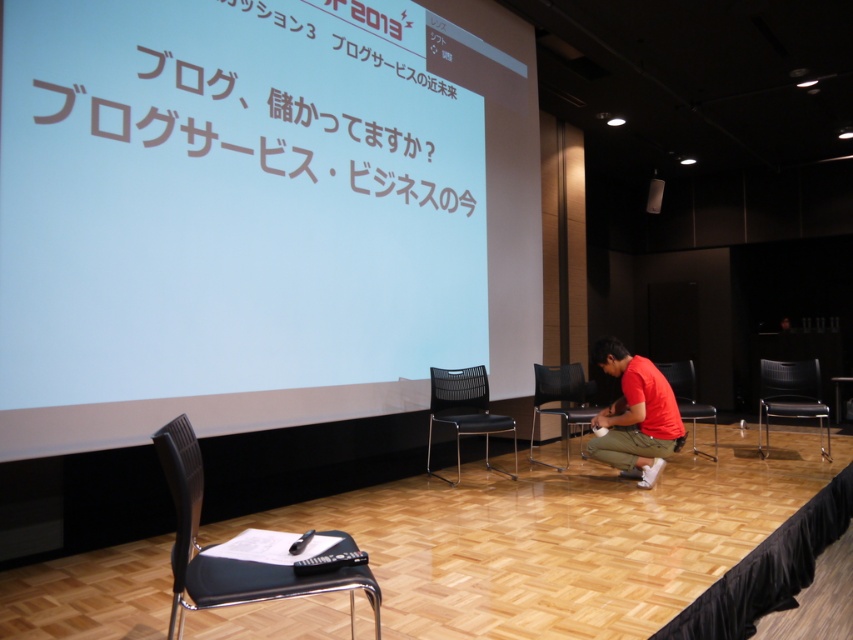
Can you confirm if black plastic chair at lower left is positioned below matte red shirt at lower right?

Yes, black plastic chair at lower left is below matte red shirt at lower right.

Is black plastic chair at lower left above matte red shirt at lower right?

No, black plastic chair at lower left is not above matte red shirt at lower right.

Does point (177, 579) lie in front of point (624, 378)?

Yes, point (177, 579) is closer to viewer.

Locate an element on the screen. black plastic chair at lower left is located at coordinates (231, 557).

Is matte red shirt at lower right smaller than black mesh chair at right?

Incorrect, matte red shirt at lower right is not smaller in size than black mesh chair at right.

Who is more forward, (x=613, y=349) or (x=775, y=380)?

Point (x=613, y=349) is in front.

This screenshot has width=853, height=640. Find the location of `matte red shirt at lower right`. matte red shirt at lower right is located at coordinates (635, 416).

Is white text on screen at center closer to camera compared to black leather chair at lower right?

That is True.

Does white text on screen at center appear under black leather chair at lower right?

Actually, white text on screen at center is above black leather chair at lower right.

Is point (448, 90) in front of point (682, 385)?

Yes.

Image resolution: width=853 pixels, height=640 pixels. In order to click on white text on screen at center in this screenshot , I will do `click(254, 129)`.